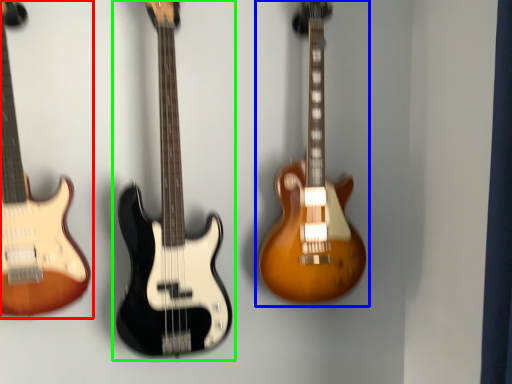
Question: Considering the real-world distances, which object is farthest from guitar (highlighted by a red box)? guitar (highlighted by a blue box) or guitar (highlighted by a green box)?

Choices:
 (A) guitar
 (B) guitar

Answer: (A)